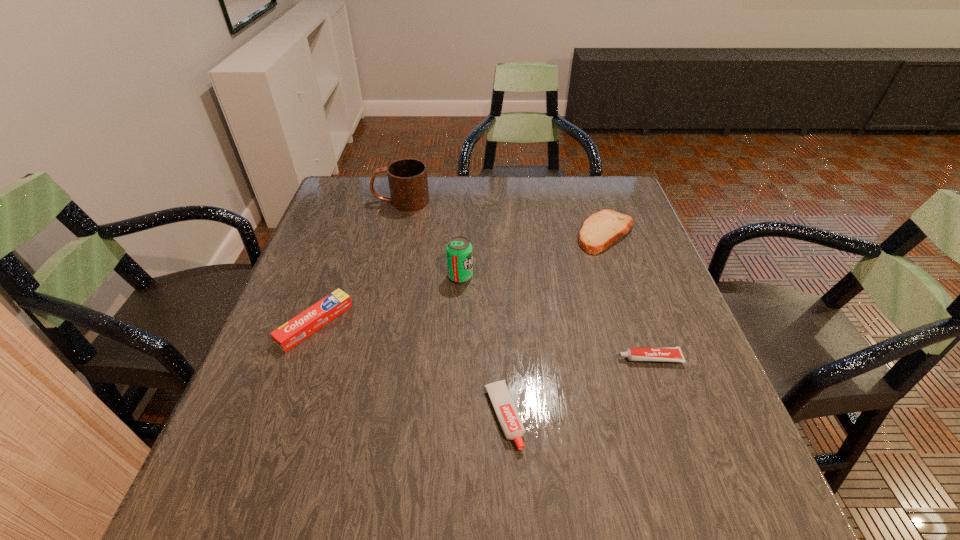
Where is `pita bread that is positioned at the right edge`? pita bread that is positioned at the right edge is located at coordinates (602, 229).

This screenshot has width=960, height=540. Identify the location of toothpaste located at the right edge. (667, 354).

What are the coordinates of `object present at the far left corner` in the screenshot? It's located at (408, 182).

Where is `object located at the far right corner`? This screenshot has height=540, width=960. object located at the far right corner is located at coordinates (602, 229).

The width and height of the screenshot is (960, 540). Identify the location of vacant space at the far edge. (422, 210).

Locate an element on the screen. The height and width of the screenshot is (540, 960). vacant region at the near edge of the desktop is located at coordinates (303, 496).

I want to click on vacant space at the left edge of the desktop, so click(336, 232).

In the image, there is a desktop. Identify the location of vacant space at the right edge. This screenshot has width=960, height=540. (706, 416).

This screenshot has height=540, width=960. What are the coordinates of `vacant area at the far left corner` in the screenshot? It's located at (374, 198).

Find the location of `vacant space at the far right corner of the desktop`. vacant space at the far right corner of the desktop is located at coordinates (615, 181).